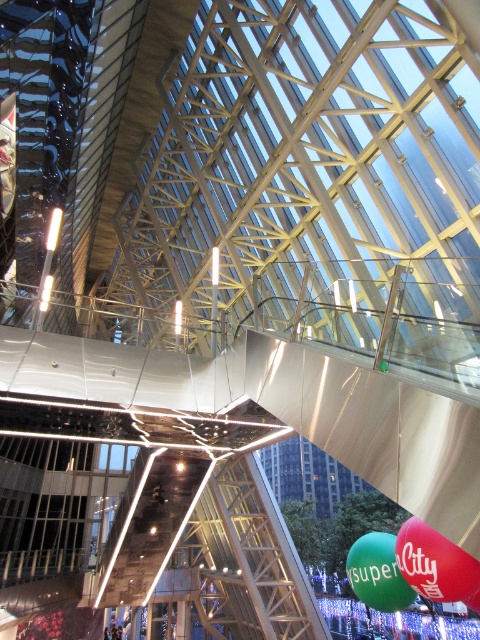
You are a child who just received two balloons, the matte red balloon at lower right and the green rubber balloon at lower right. You notice that one is lower than the other. Which balloon is closer to the ground?

The matte red balloon at lower right is closer to the ground since it has a lesser height compared to the green rubber balloon at lower right.

You are standing in the modern building and see the point marked at coordinate (434, 563). What object is located at that point?

The point at coordinate (434, 563) corresponds to the matte red balloon at lower right.

You are at the mall and see two balloons at the lower right corner of the space. The balloons are labeled as matte red balloon at lower right and green rubber balloon at lower right. Which balloon is smaller in width?

The matte red balloon at lower right is smaller in width than the green rubber balloon at lower right.